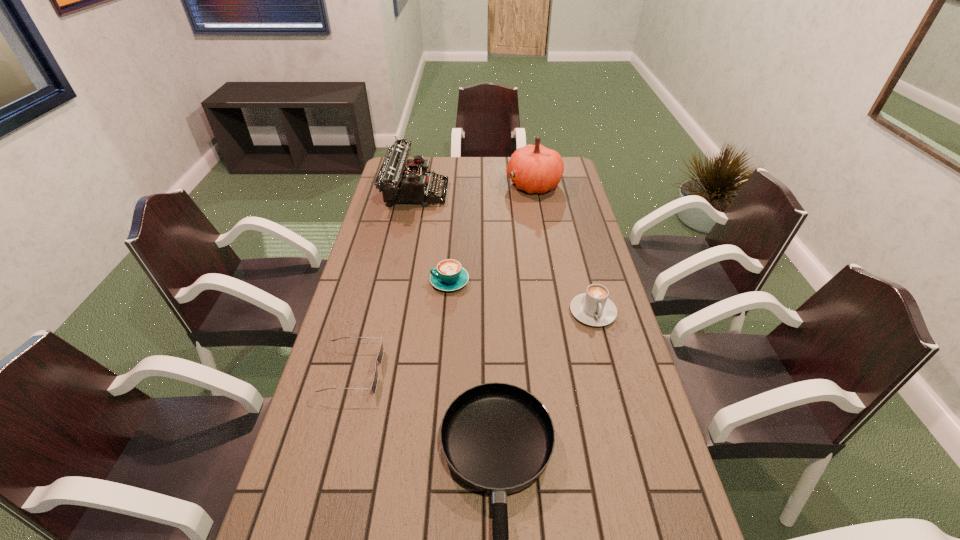
Where is `free space located 0.080m on the keyboard of the second tallest object`? free space located 0.080m on the keyboard of the second tallest object is located at coordinates (467, 192).

You are a GUI agent. You are given a task and a screenshot of the screen. Output one action in this format:
    pyautogui.click(x=<x>, y=<y>)
    Task: Click on the free region located to the right of the taller cappuccino
    The image size is (960, 540).
    Given the screenshot: What is the action you would take?
    pyautogui.click(x=626, y=437)

I want to click on vacant space located 0.250m with the handle on the right side of the left cappuccino, so click(354, 281).

The height and width of the screenshot is (540, 960). In order to click on free space located with the handle on the right side of the left cappuccino in this screenshot , I will do `click(375, 281)`.

Locate an element on the screen. The image size is (960, 540). vacant space positioned 0.150m with the handle on the right side of the left cappuccino is located at coordinates (385, 281).

Locate an element on the screen. vacant space located 0.400m on the front-facing side of the shortest object is located at coordinates (528, 372).

The height and width of the screenshot is (540, 960). I want to click on pumpkin at the far edge, so click(537, 169).

Where is `typewriter that is positioned at the far edge`? The width and height of the screenshot is (960, 540). typewriter that is positioned at the far edge is located at coordinates (399, 183).

I want to click on typewriter that is at the left edge, so click(x=399, y=183).

Locate an element on the screen. This screenshot has width=960, height=540. sunglasses positioned at the left edge is located at coordinates (380, 356).